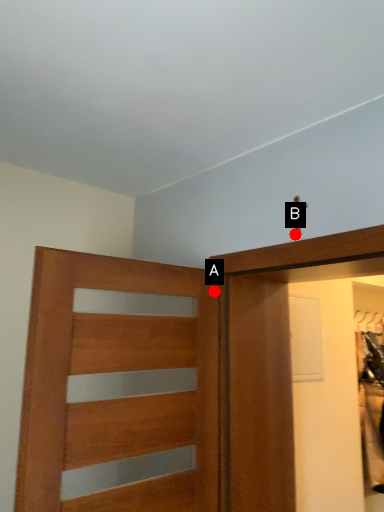
Question: Two points are circled on the image, labeled by A and B beside each circle. Among these points, which one is farthest from the camera?

Choices:
 (A) A is further
 (B) B is further

Answer: (A)